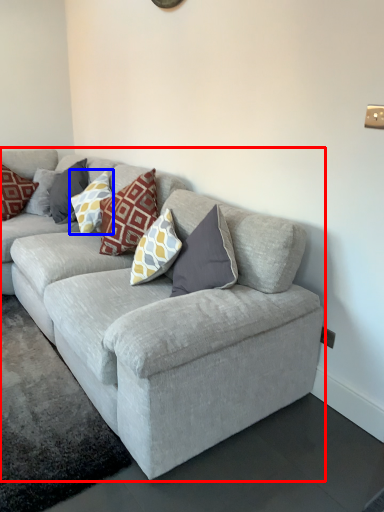
Question: Which object appears farthest to the camera in this image, studio couch (highlighted by a red box) or pillow (highlighted by a blue box)?

Choices:
 (A) studio couch
 (B) pillow

Answer: (B)